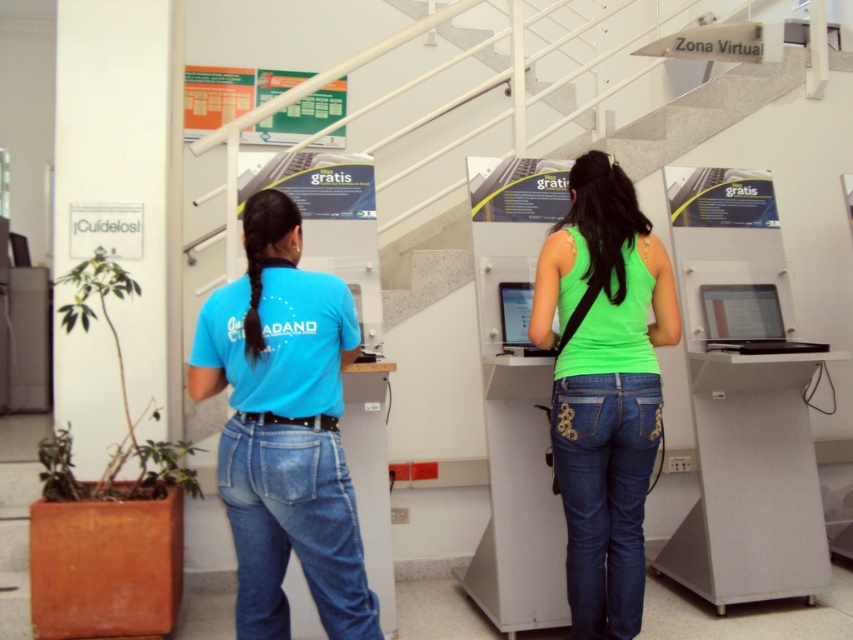
From the picture: You are standing in front of the Zona Virtual kiosk and see two people in front of you. One is wearing a matte blue shirt at center and the other a neon green tank top at center. Which person is closer to you?

The matte blue shirt at center is closer to the viewer than the neon green tank top at center, so the person in the matte blue shirt at center is closer to you.

You are a photographer trying to capture a closeup of the kiosk. You notice the matte blue shirt at center and dark blue denim jeans at center might block your view. Which object is wider and could potentially block more of the kiosk if moved closer?

The matte blue shirt at center might be wider than dark blue denim jeans at center, so it could block more of the kiosk if moved closer.

Consider the image. You are a security guard in the room and need to determine if the neon green tank top at center can be fully covered by a rectangular privacy screen that is the same width as the blue denim jeans at center. Can it be covered?

The neon green tank top at center might be wider than blue denim jeans at center, so the privacy screen sized to the jeans might not fully cover the tank top.